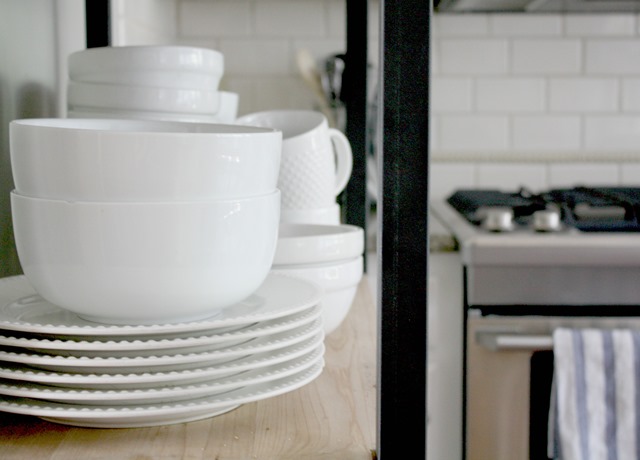
The height and width of the screenshot is (460, 640). Find the location of `saucers`. saucers is located at coordinates (287, 308), (291, 324), (292, 336), (291, 355), (297, 366), (298, 382).